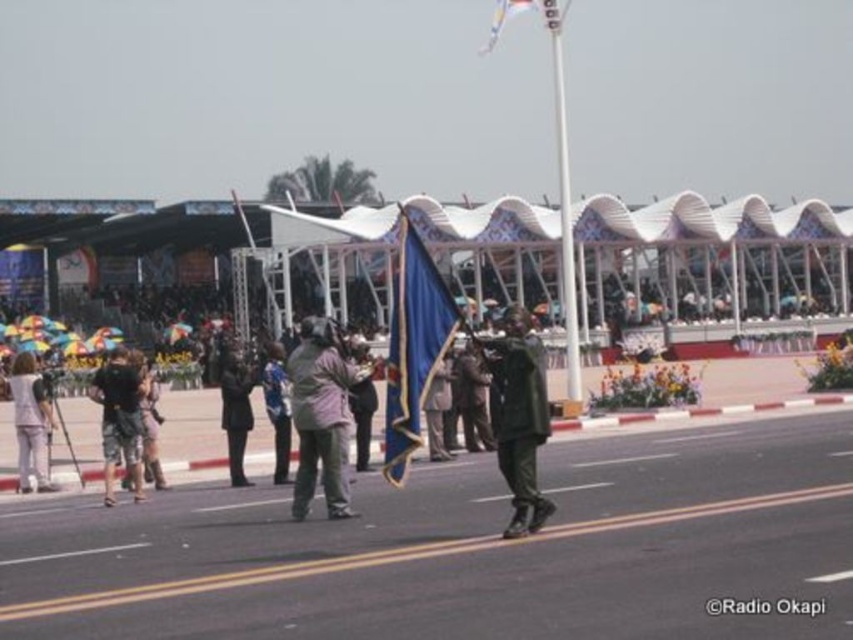
Is pink fabric jacket at center wider than dark green camouflage pants at center?

No.

Can you confirm if pink fabric jacket at center is positioned to the right of dark green camouflage pants at center?

Correct, you'll find pink fabric jacket at center to the right of dark green camouflage pants at center.

Who is more forward, [312,317] or [115,356]?

Point [312,317] is more forward.

Find the location of a particular element. pink fabric jacket at center is located at coordinates (320, 416).

Can you confirm if white cotton pants at lower left is positioned to the left of blue fabric flag at upper center?

Yes, white cotton pants at lower left is to the left of blue fabric flag at upper center.

Who is more forward, (26, 436) or (502, 20)?

Point (26, 436) is in front.

Describe the element at coordinates (32, 422) in the screenshot. The image size is (853, 640). I see `white cotton pants at lower left` at that location.

You are a GUI agent. You are given a task and a screenshot of the screen. Output one action in this format:
    pyautogui.click(x=<x>, y=<y>)
    Task: Click on the white cotton pants at lower left
    This screenshot has height=640, width=853.
    Given the screenshot: What is the action you would take?
    pyautogui.click(x=32, y=422)

How distant is pink fabric jacket at center from black fabric coat at center?

A distance of 15.35 feet exists between pink fabric jacket at center and black fabric coat at center.

Does point (332, 339) come closer to viewer compared to point (247, 484)?

Yes, it is in front of point (247, 484).

At what (x,y) coordinates should I click in order to perform the action: click on pink fabric jacket at center. Please return your answer as a coordinate pair (x, y). The image size is (853, 640). Looking at the image, I should click on (320, 416).

Where is `pink fabric jacket at center`? Image resolution: width=853 pixels, height=640 pixels. pink fabric jacket at center is located at coordinates (320, 416).